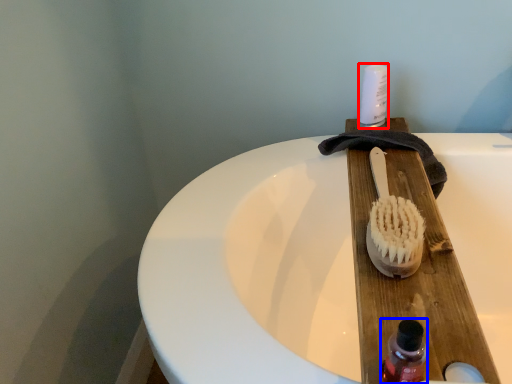
Question: Which point is further to the camera, toiletry (highlighted by a red box) or bottle (highlighted by a blue box)?

Choices:
 (A) toiletry
 (B) bottle

Answer: (A)